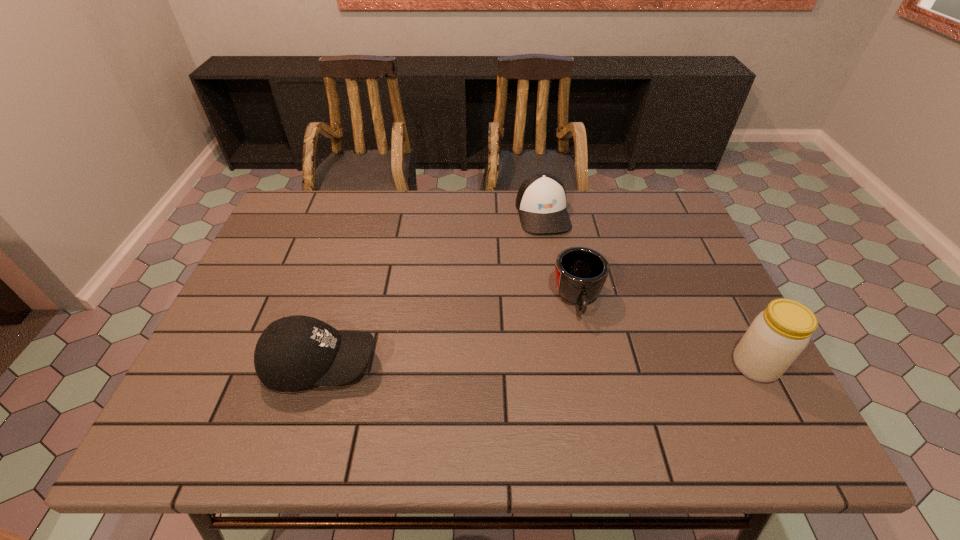
The image size is (960, 540). I want to click on free space located on the side of the third nearest object with the handle, so click(588, 367).

Locate an element on the screen. This screenshot has height=540, width=960. vacant space situated 0.100m on the side of the third nearest object with the handle is located at coordinates (587, 360).

Locate an element on the screen. vacant space located 0.130m on the side of the third nearest object with the handle is located at coordinates (588, 371).

Image resolution: width=960 pixels, height=540 pixels. I want to click on object situated at the far edge, so click(541, 200).

What are the coordinates of `baseball cap that is at the near edge` in the screenshot? It's located at (294, 352).

At what (x,y) coordinates should I click in order to perform the action: click on jar at the near edge. Please return your answer as a coordinate pair (x, y). Looking at the image, I should click on (777, 336).

You are a GUI agent. You are given a task and a screenshot of the screen. Output one action in this format:
    pyautogui.click(x=<x>, y=<y>)
    Task: Click on the object present at the left edge
    
    Given the screenshot: What is the action you would take?
    pyautogui.click(x=294, y=352)

Identify the location of object that is positioned at the right edge. The height and width of the screenshot is (540, 960). [777, 336].

Where is `object present at the near left corner`? object present at the near left corner is located at coordinates (294, 352).

The height and width of the screenshot is (540, 960). I want to click on object that is at the near right corner, so click(777, 336).